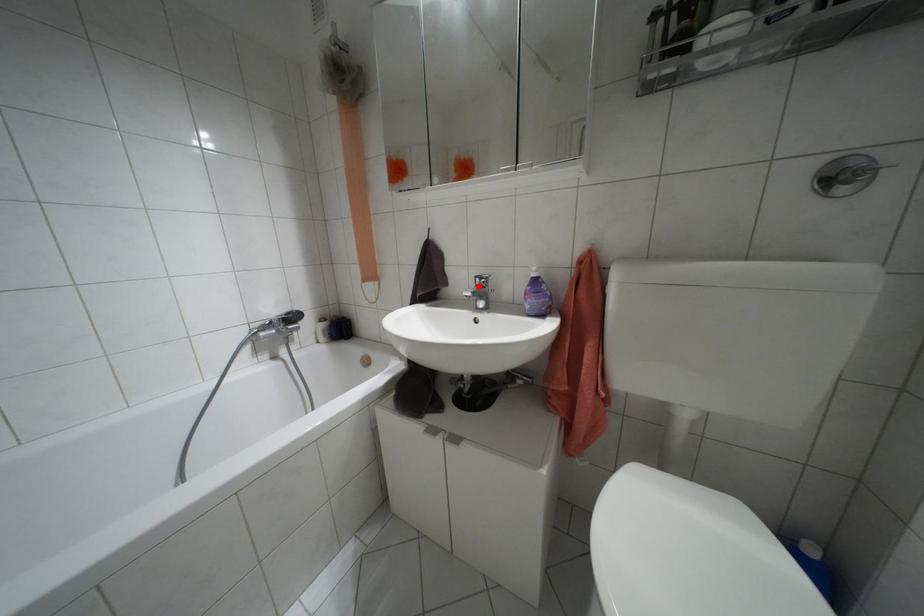
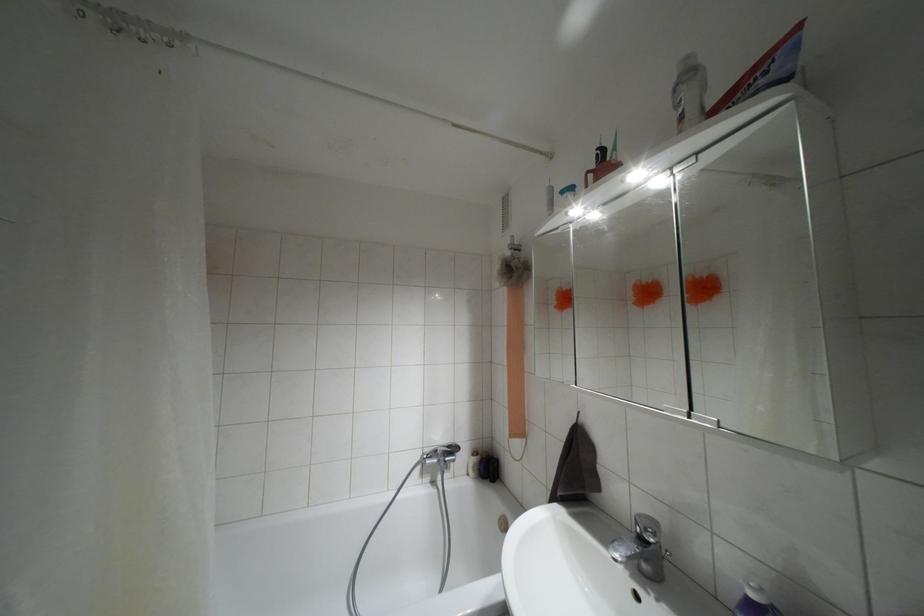
Where in the second image is the point corresponding to the highlighted location from the first image?

(641, 538)